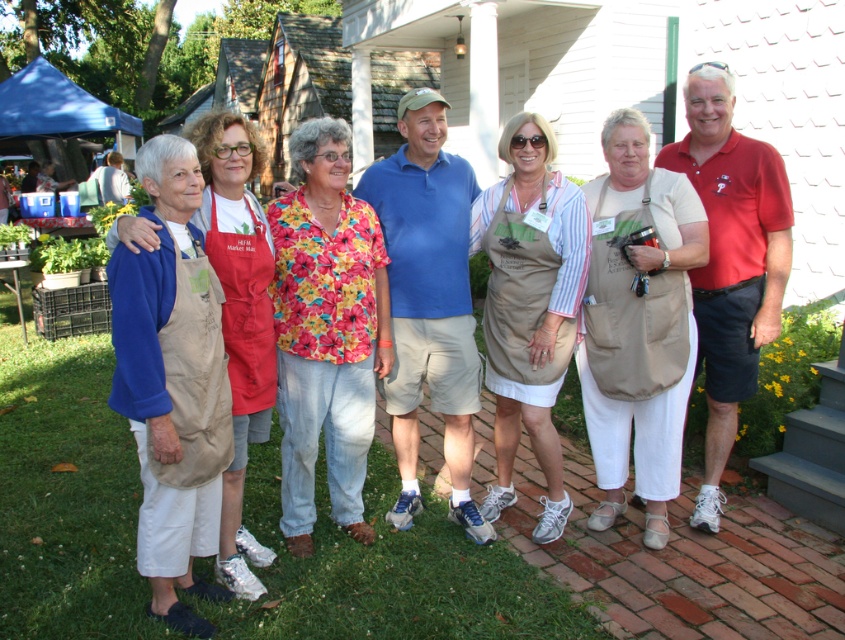
From the picture: You are standing in front of the white house with the brick pathway. You see a point at coordinates (169, 380). Which object is this point located on?

The point is located on the beige fabric apron at left.

Based on the photo, you are standing in front of the white house and want to greet the person wearing the beige fabric apron at left and the person wearing the tan fabric apron at center. Which apron wearer is closer to you?

The beige fabric apron at left is closer to you because it is in front of the tan fabric apron at center.